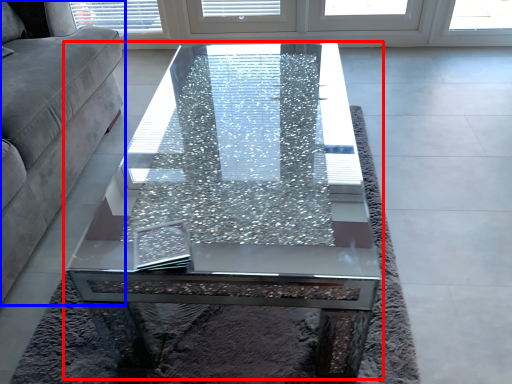
Question: Which object is further to the camera taking this photo, coffee table (highlighted by a red box) or studio couch (highlighted by a blue box)?

Choices:
 (A) coffee table
 (B) studio couch

Answer: (A)